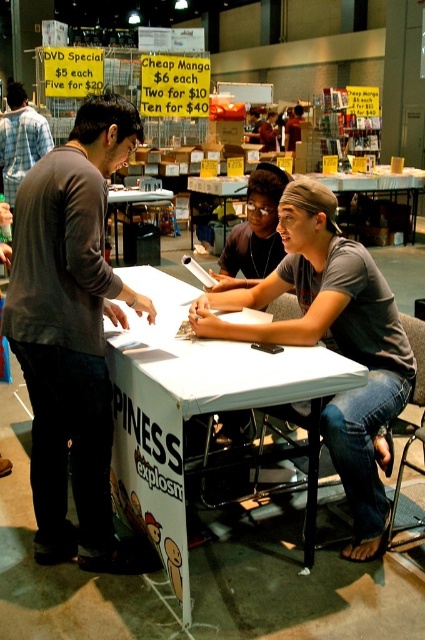
You are a photographer at the event and need to capture a clear shot of both the white paper at center and the plaid shirt at left. Since you can only focus on one object at a time, which one should you focus on to ensure it appears sharp in the photo?

You should focus on the white paper at center because it is closer to the viewer than the plaid shirt at left, so focusing on it will keep it sharp while the plaid shirt may appear slightly blurry.

You are a photographer at the event and want to capture a photo of both the white paper at center and the matte gray shirt at center in the same frame. The camera you are using has a maximum focus range of 35 centimeters. Can you fit both objects in the frame without moving the camera?

The distance between the white paper at center and the matte gray shirt at center is 37.58 centimeters, which exceeds the camera maximum focus range of 35 centimeters. Therefore, you cannot fit both objects in the frame without moving the camera.